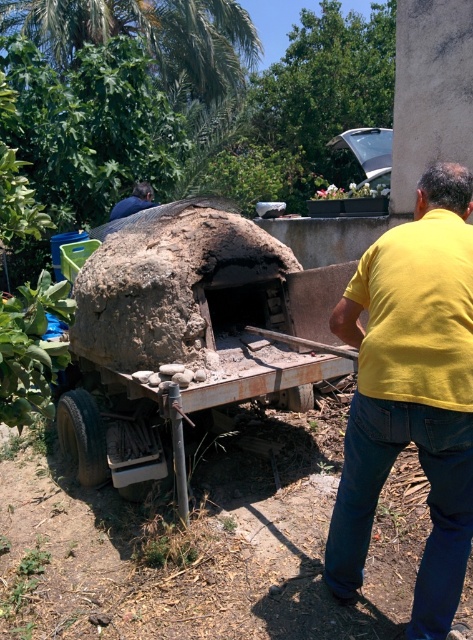
Does yellow cotton shirt at center come behind yellow matte shirt at upper right?

No, it is not.

Does yellow cotton shirt at center have a lesser width compared to yellow matte shirt at upper right?

No.

This screenshot has height=640, width=473. Describe the element at coordinates (411, 394) in the screenshot. I see `yellow cotton shirt at center` at that location.

This screenshot has width=473, height=640. In order to click on yellow cotton shirt at center in this screenshot , I will do coord(411,394).